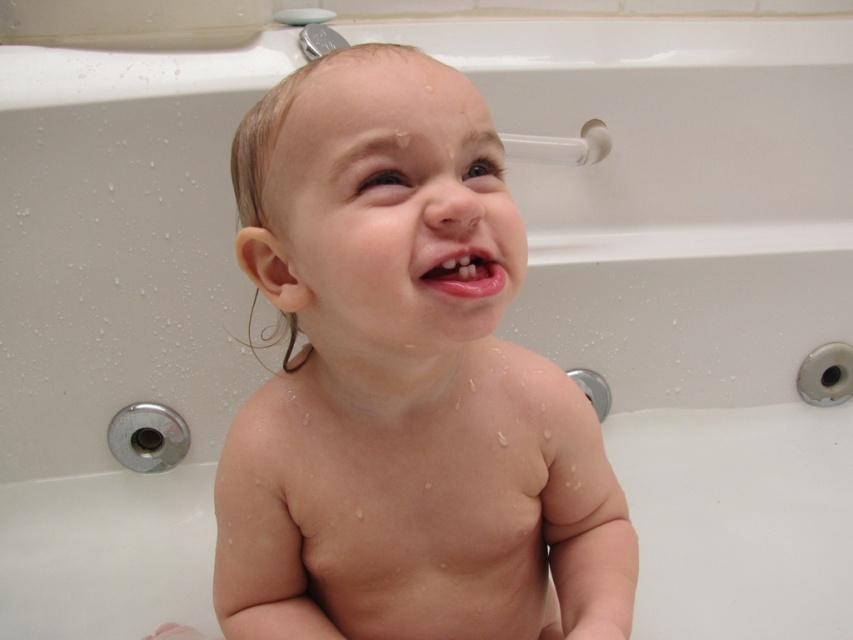
Question: Which point is farther from the camera taking this photo?

Choices:
 (A) (486, 278)
 (B) (282, 195)

Answer: (B)

Question: Does smooth skin baby at center appear over pink glossy lips at center?

Choices:
 (A) no
 (B) yes

Answer: (A)

Question: Is smooth skin baby at center to the left of pink glossy lips at center from the viewer's perspective?

Choices:
 (A) yes
 (B) no

Answer: (A)

Question: Is smooth skin baby at center closer to camera compared to pink glossy lips at center?

Choices:
 (A) yes
 (B) no

Answer: (A)